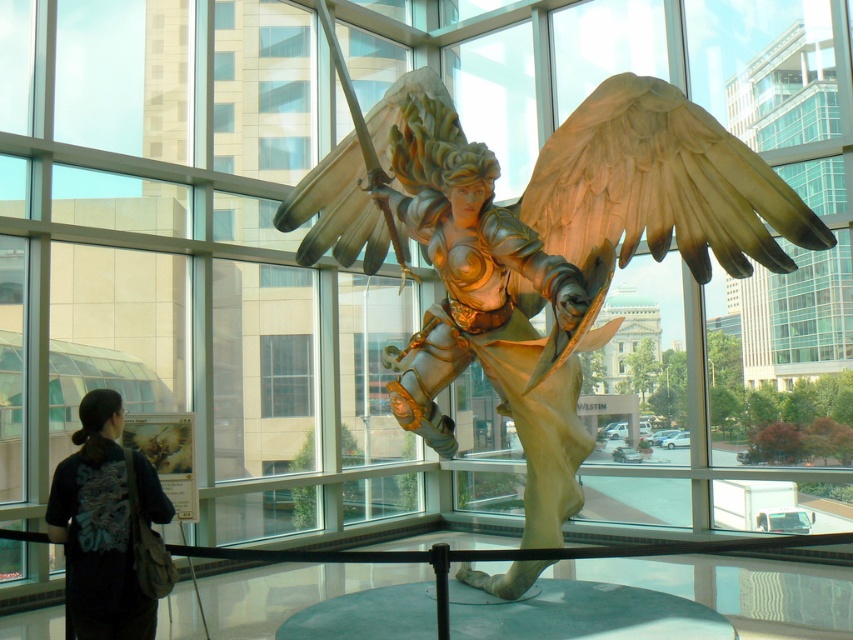
You are standing in front of the statue and want to determine which of the two points, point (x=374, y=157) or point (x=77, y=465), is closer to you. Based on the statue layout, which point is nearer?

Point (x=374, y=157) is closer to you than point (x=77, y=465) because it is further to the viewer.

You are a security guard in the building and need to check the distance between the bronze statue at center and the black fabric bag at lower left. The safety protocol requires that all bags must be at least 10 feet away from displayed artifacts. Is the current placement compliant with the safety protocol?

The distance between the bronze statue at center and the black fabric bag at lower left is 8.02 feet, which is less than the required 10 feet. Therefore, the current placement does not comply with the safety protocol.